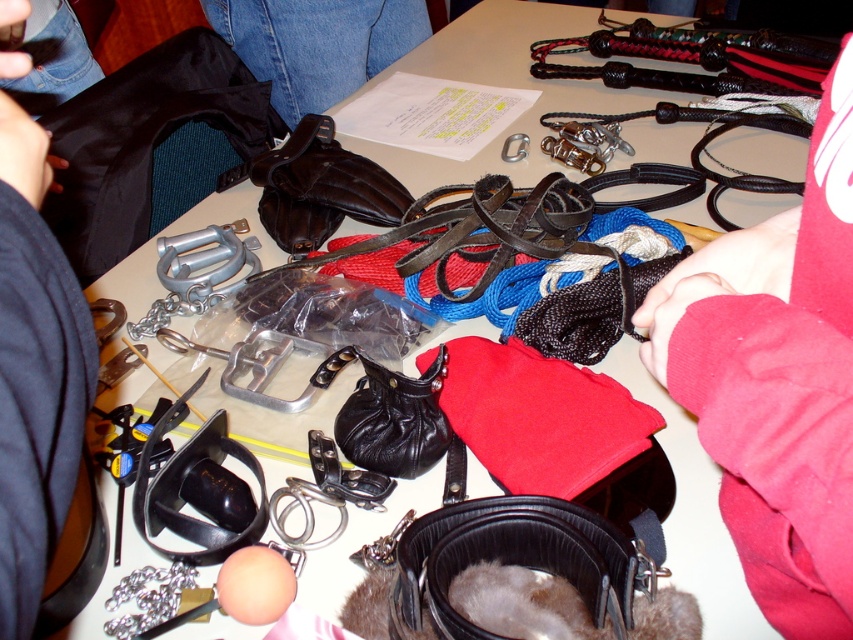
Can you confirm if red fabric sleeve at upper right is thinner than black leather purse at center?

Correct, red fabric sleeve at upper right's width is less than black leather purse at center's.

Who is more distant from viewer, (846, 401) or (354, 451)?

Positioned behind is point (354, 451).

This screenshot has height=640, width=853. In order to click on red fabric sleeve at upper right in this screenshot , I will do `click(776, 380)`.

Which is behind, point (281, 99) or point (425, 433)?

Positioned behind is point (281, 99).

Is point (425, 29) more distant than point (434, 380)?

Yes, it is behind point (434, 380).

What are the coordinates of `jeans at upper center` in the screenshot? It's located at (316, 44).

You are a GUI agent. You are given a task and a screenshot of the screen. Output one action in this format:
    pyautogui.click(x=<x>, y=<y>)
    Task: Click on the red fabric sleeve at upper right
    
    Given the screenshot: What is the action you would take?
    coord(776,380)

Can you confirm if red fabric sleeve at upper right is shorter than red leather jacket at lower right?

Incorrect, red fabric sleeve at upper right's height does not fall short of red leather jacket at lower right's.

Does point (830, 522) come behind point (41, 476)?

No.

Locate an element on the screen. The height and width of the screenshot is (640, 853). red fabric sleeve at upper right is located at coordinates (776, 380).